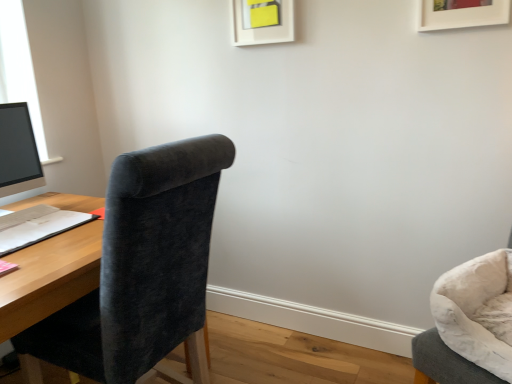
You are a GUI agent. You are given a task and a screenshot of the screen. Output one action in this format:
    pyautogui.click(x=<x>, y=<y>)
    Task: Click on the empty space that is ontop of white paper at left (from a real-world perspective)
    This screenshot has width=512, height=384.
    Given the screenshot: What is the action you would take?
    pyautogui.click(x=26, y=222)